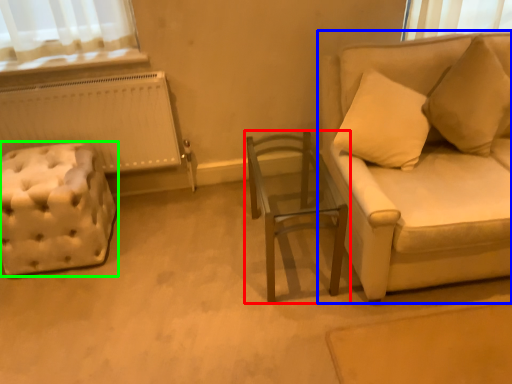
Question: Estimate the real-world distances between objects in this image. Which object is closer to table (highlighted by a red box), studio couch (highlighted by a blue box) or furniture (highlighted by a green box)?

Choices:
 (A) studio couch
 (B) furniture

Answer: (A)